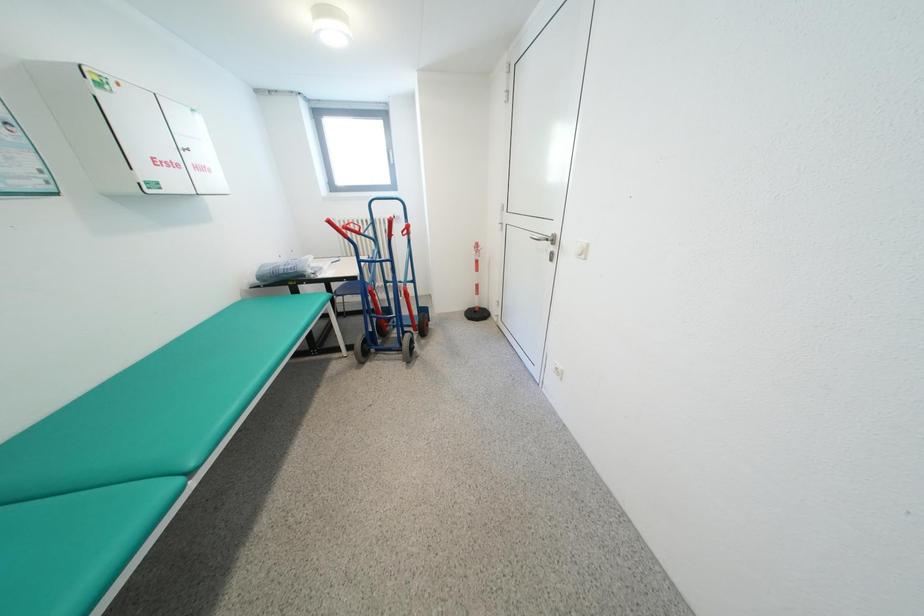
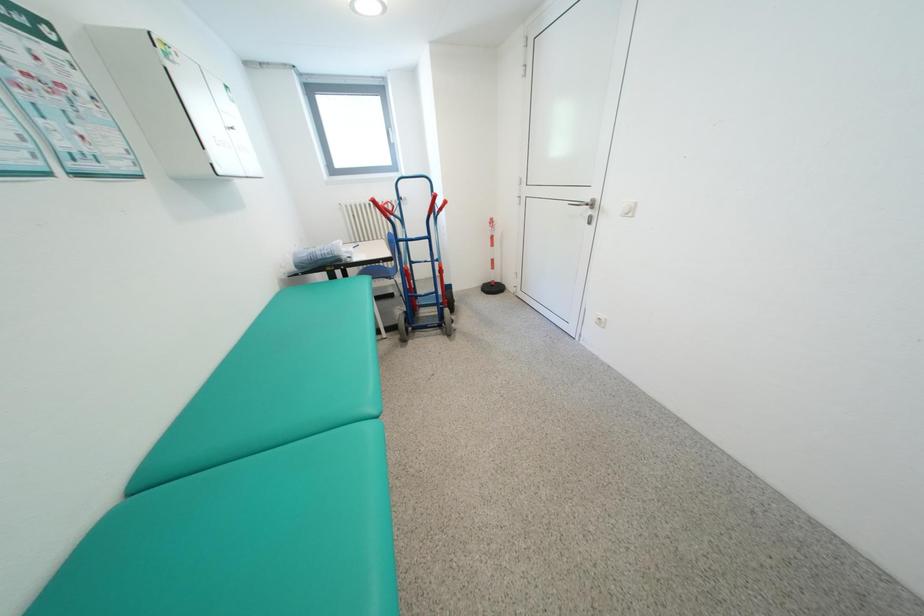
Question: Which direction would the cameraman need to move to produce the second image? Reply with the corresponding letter.

Choices:
 (A) Left
 (B) Right
 (C) Forward
 (D) Backward

Answer: (A)